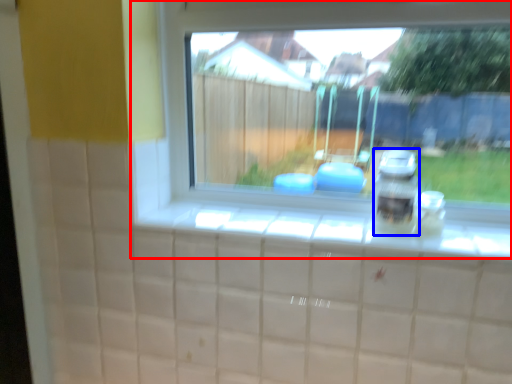
Question: Which object appears closest to the camera in this image, window (highlighted by a red box) or appliance (highlighted by a blue box)?

Choices:
 (A) window
 (B) appliance

Answer: (A)